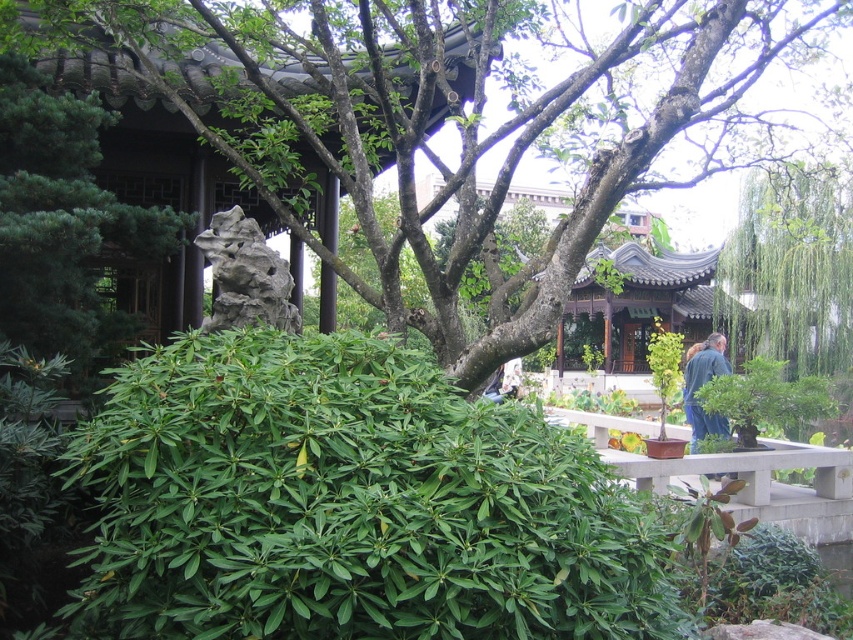
You are a gardener planning to plant a new flower bed between the gray stone rock at center and the green leafy bush at right. Based on their positions, which object should you start digging near first?

The gray stone rock at center is closer to the viewer than the green leafy bush at right, so you should start digging near the gray stone rock at center first.

You are a visitor in the garden and want to take a photo of both the green leafy bush at center and the blue denim jacket at lower right. Which object should you focus on first if you want to capture both in the same frame without moving the camera?

The green leafy bush at center is bigger than the blue denim jacket at lower right, so you should focus on the green leafy bush at center first to ensure it fits properly in the frame before adjusting for the smaller blue denim jacket at lower right.